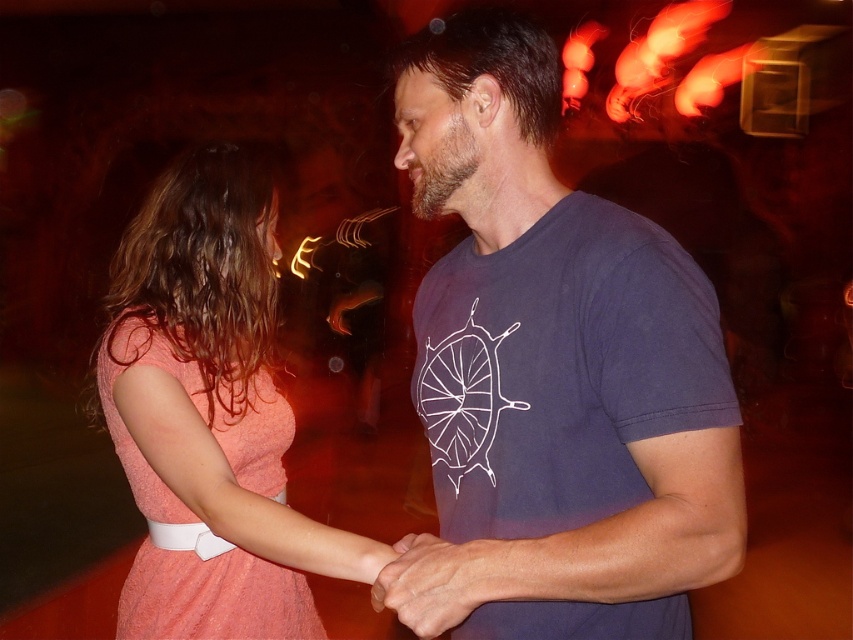
Can you confirm if dark blue t-shirt at center is shorter than matte coral dress at center?

Yes, dark blue t-shirt at center is shorter than matte coral dress at center.

You are a GUI agent. You are given a task and a screenshot of the screen. Output one action in this format:
    pyautogui.click(x=<x>, y=<y>)
    Task: Click on the dark blue t-shirt at center
    This screenshot has height=640, width=853.
    Given the screenshot: What is the action you would take?
    pyautogui.click(x=552, y=372)

The image size is (853, 640). Identify the location of dark blue t-shirt at center. (552, 372).

Find the location of a particular element. The height and width of the screenshot is (640, 853). dark blue t-shirt at center is located at coordinates (552, 372).

From the picture: Is matte coral dress at center to the right of coral fabric dress at left from the viewer's perspective?

Correct, you'll find matte coral dress at center to the right of coral fabric dress at left.

Who is positioned more to the left, matte coral dress at center or coral fabric dress at left?

Positioned to the left is coral fabric dress at left.

Which is in front, point (225, 202) or point (213, 422)?

Point (213, 422) is in front.

Where is `matte coral dress at center`? This screenshot has height=640, width=853. matte coral dress at center is located at coordinates (210, 413).

Between dark blue t-shirt at center and coral fabric dress at left, which one has less height?

coral fabric dress at left is shorter.

Which is above, dark blue t-shirt at center or coral fabric dress at left?

Positioned higher is dark blue t-shirt at center.

This screenshot has width=853, height=640. What are the coordinates of `dark blue t-shirt at center` in the screenshot? It's located at (552, 372).